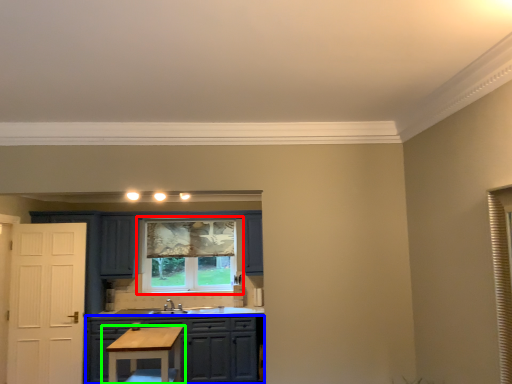
Question: Based on their relative distances, which object is nearer to window (highlighted by a red box)? Choose from cabinetry (highlighted by a blue box) and table (highlighted by a green box).

Choices:
 (A) cabinetry
 (B) table

Answer: (A)